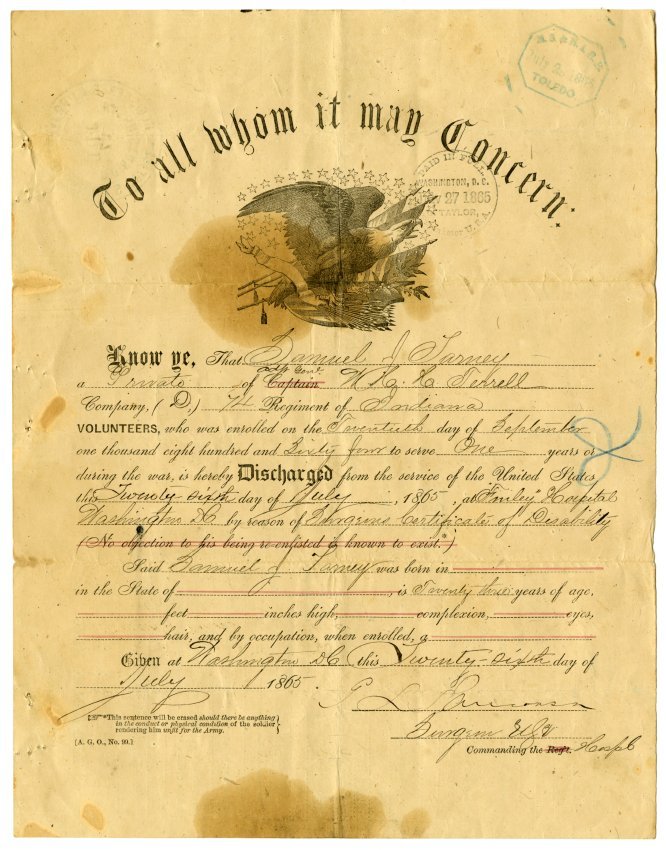
The height and width of the screenshot is (850, 666). I want to click on water stain, so click(x=274, y=824).